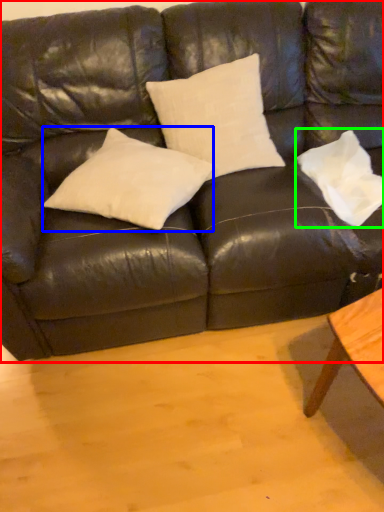
Question: Considering the real-world distances, which object is farthest from studio couch (highlighted by a red box)? pillow (highlighted by a blue box) or pillow (highlighted by a green box)?

Choices:
 (A) pillow
 (B) pillow

Answer: (B)